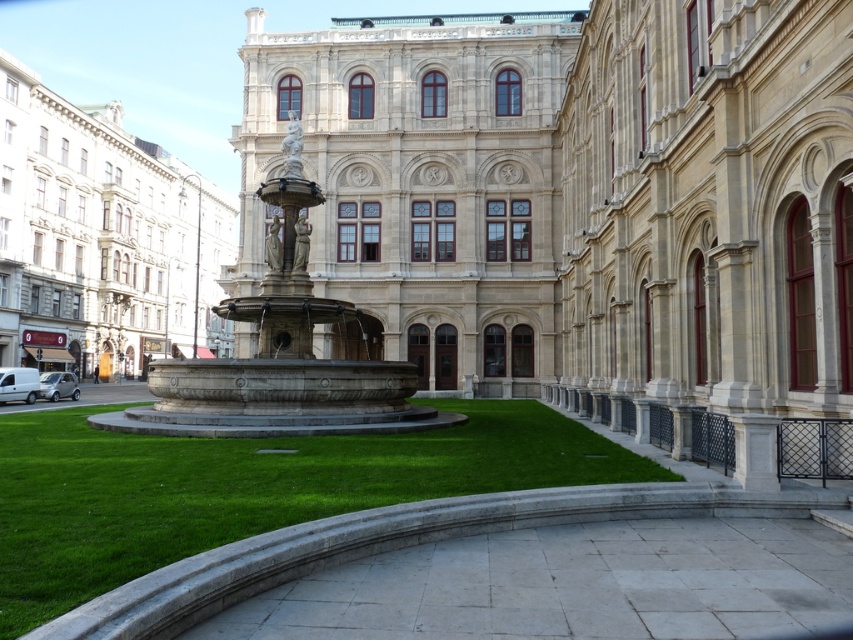
Question: Which point appears closest to the camera in this image?

Choices:
 (A) (276, 241)
 (B) (268, 486)
 (C) (142, 221)

Answer: (B)

Question: Does green grass at center have a larger size compared to stone fountain at center?

Choices:
 (A) yes
 (B) no

Answer: (B)

Question: Can you confirm if marble fountain at center is positioned above white marble statue at upper center?

Choices:
 (A) yes
 (B) no

Answer: (B)

Question: Does white marble statue at upper center appear under polished bronze statue at center?

Choices:
 (A) no
 (B) yes

Answer: (A)

Question: Estimate the real-world distances between objects in this image. Which object is closer to the white marble statue at upper center?

Choices:
 (A) green grass at center
 (B) marble fountain at center

Answer: (A)

Question: Which of the following is the closest to the observer?

Choices:
 (A) (189, 541)
 (B) (48, 144)

Answer: (A)